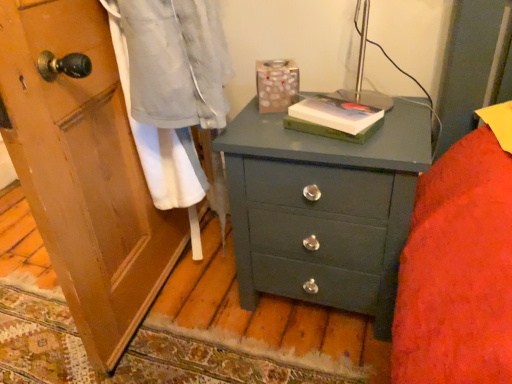
Where is `free point in front of hardcover book at center, acting as the 1th book starting from the top`? free point in front of hardcover book at center, acting as the 1th book starting from the top is located at coordinates [x=355, y=141].